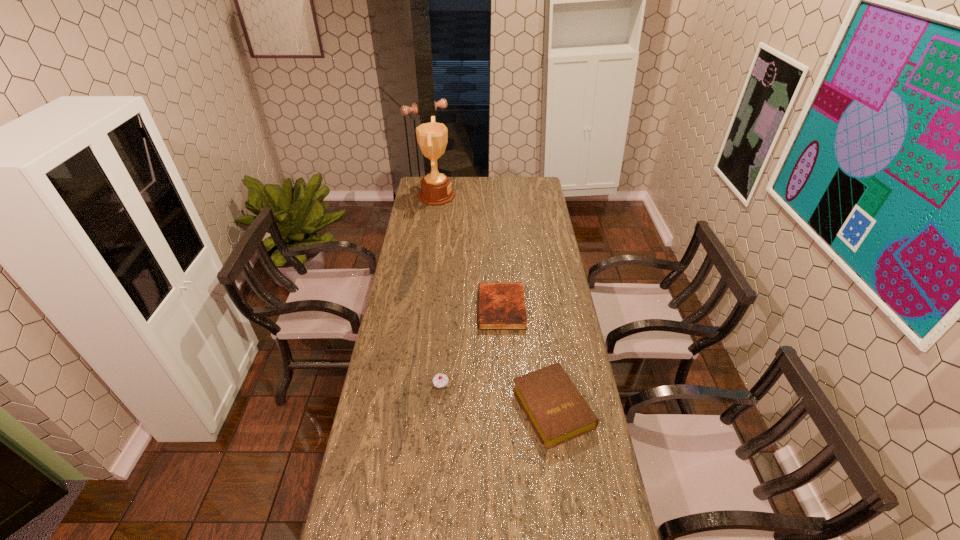
This screenshot has height=540, width=960. In the image, there is a desktop. Find the location of `vacant space at the far left corner`. vacant space at the far left corner is located at coordinates (414, 188).

I want to click on free spot between the shortest object and the award, so click(x=468, y=252).

The width and height of the screenshot is (960, 540). What are the coordinates of `free spot between the nearer Bible and the cupcake` in the screenshot? It's located at (497, 397).

The height and width of the screenshot is (540, 960). In order to click on vacant space that's between the taller Bible and the cupcake in this screenshot , I will do `click(497, 397)`.

Where is `vacant area that lies between the third shortest object and the shorter Bible`? The image size is (960, 540). vacant area that lies between the third shortest object and the shorter Bible is located at coordinates (471, 347).

Locate an element on the screen. This screenshot has width=960, height=540. unoccupied area between the tallest object and the shorter Bible is located at coordinates (468, 252).

At what (x,y) coordinates should I click in order to perform the action: click on free spot between the shortest object and the nearer Bible. Please return your answer as a coordinate pair (x, y). The image size is (960, 540). Looking at the image, I should click on (527, 359).

Where is `empty space that is in between the tallest object and the third nearest object`? The image size is (960, 540). empty space that is in between the tallest object and the third nearest object is located at coordinates (468, 252).

You are a GUI agent. You are given a task and a screenshot of the screen. Output one action in this format:
    pyautogui.click(x=<x>, y=<y>)
    Task: Click on the free space between the cupcake and the taller Bible
    This screenshot has height=540, width=960.
    Given the screenshot: What is the action you would take?
    pyautogui.click(x=497, y=397)

You are a GUI agent. You are given a task and a screenshot of the screen. Output one action in this format:
    pyautogui.click(x=<x>, y=<y>)
    Task: Click on the vacant space that's between the farthest object and the shortest object
    The image size is (960, 540).
    Given the screenshot: What is the action you would take?
    pyautogui.click(x=468, y=252)